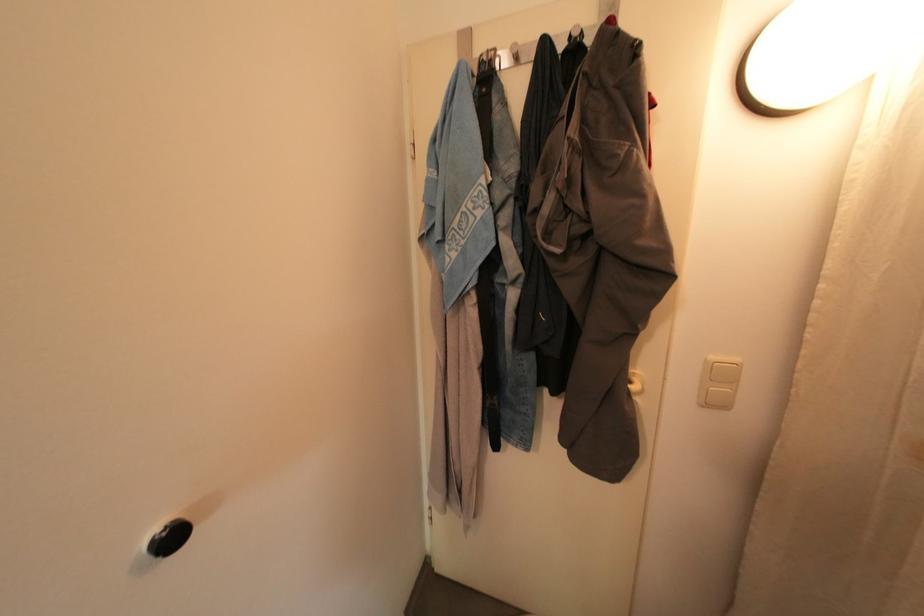
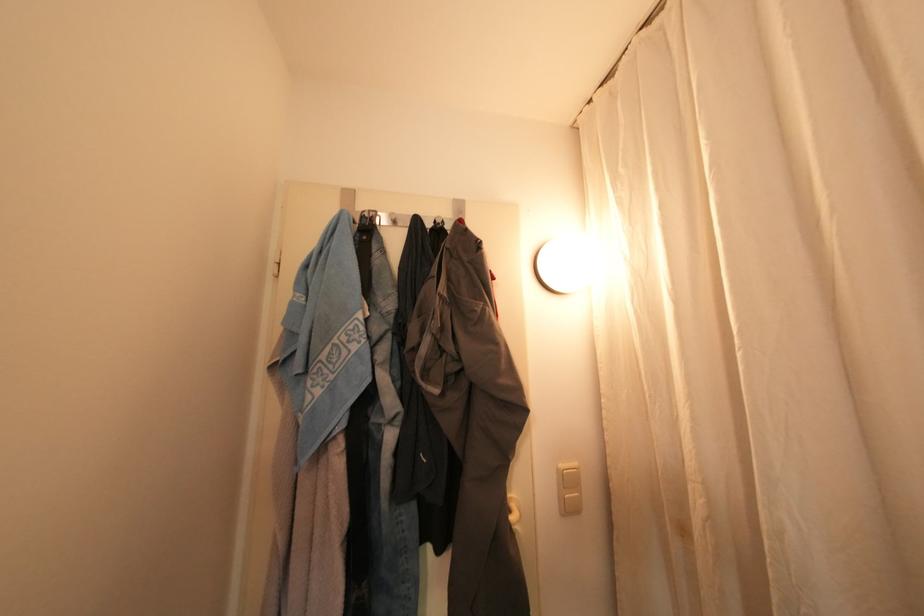
Where in the second image is the point corresponding to (638,389) from the first image?

(517, 519)